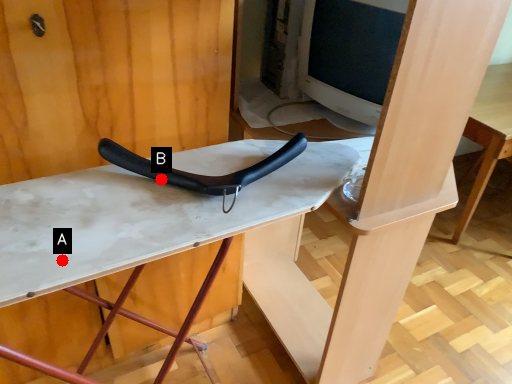
Question: Two points are circled on the image, labeled by A and B beside each circle. Which point is further to the camera?

Choices:
 (A) A is further
 (B) B is further

Answer: (B)